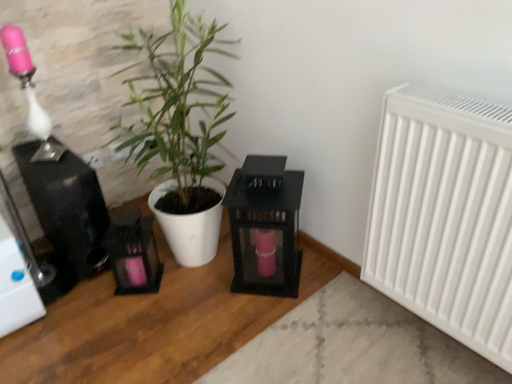
Question: From the image's perspective, is black glass lantern at center above white matte plant pot at center?

Choices:
 (A) no
 (B) yes

Answer: (A)

Question: From a real-world perspective, does black glass lantern at center sit lower than white matte plant pot at center?

Choices:
 (A) yes
 (B) no

Answer: (A)

Question: Would you consider black glass lantern at center to be distant from white matte plant pot at center?

Choices:
 (A) yes
 (B) no

Answer: (B)

Question: Does black glass lantern at center appear on the right side of white matte plant pot at center?

Choices:
 (A) no
 (B) yes

Answer: (B)

Question: Is black glass lantern at center next to white matte plant pot at center?

Choices:
 (A) no
 (B) yes

Answer: (A)

Question: Considering their positions, is matte pink glass at upper left located in front of or behind white matte plant pot at center?

Choices:
 (A) front
 (B) behind

Answer: (B)

Question: Would you say matte pink glass at upper left is inside or outside white matte plant pot at center?

Choices:
 (A) inside
 (B) outside

Answer: (B)

Question: In terms of height, does matte pink glass at upper left look taller or shorter compared to white matte plant pot at center?

Choices:
 (A) tall
 (B) short

Answer: (B)

Question: From the image's perspective, is matte pink glass at upper left positioned above or below white matte plant pot at center?

Choices:
 (A) above
 (B) below

Answer: (A)

Question: From the image's perspective, is white matte radiator at right above or below matte pink glass at upper left?

Choices:
 (A) below
 (B) above

Answer: (A)

Question: Is white matte radiator at right in front of or behind matte pink glass at upper left in the image?

Choices:
 (A) front
 (B) behind

Answer: (A)

Question: In the image, is white matte radiator at right on the left side or the right side of matte pink glass at upper left?

Choices:
 (A) right
 (B) left

Answer: (A)

Question: Considering the positions of white matte radiator at right and matte pink glass at upper left in the image, is white matte radiator at right wider or thinner than matte pink glass at upper left?

Choices:
 (A) wide
 (B) thin

Answer: (B)

Question: In the image, is white matte plant pot at center on the left side or the right side of matte pink glass at upper left?

Choices:
 (A) left
 (B) right

Answer: (B)

Question: From the image's perspective, relative to matte pink glass at upper left, is white matte plant pot at center above or below?

Choices:
 (A) above
 (B) below

Answer: (B)